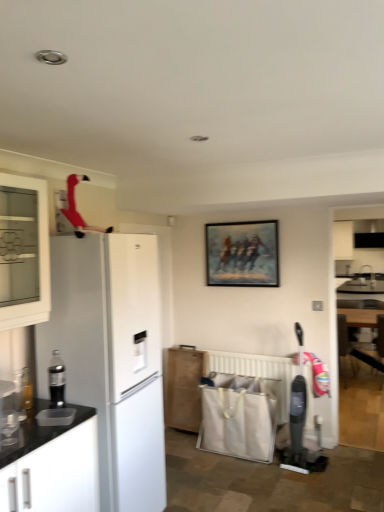
Question: Considering the relative sizes of white plastic radiator at lower center and wooden armchair at lower right in the image provided, is white plastic radiator at lower center thinner than wooden armchair at lower right?

Choices:
 (A) yes
 (B) no

Answer: (A)

Question: From a real-world perspective, is white plastic radiator at lower center positioned under wooden armchair at lower right based on gravity?

Choices:
 (A) yes
 (B) no

Answer: (B)

Question: Does white plastic radiator at lower center come in front of wooden armchair at lower right?

Choices:
 (A) no
 (B) yes

Answer: (B)

Question: Does white plastic radiator at lower center touch wooden armchair at lower right?

Choices:
 (A) no
 (B) yes

Answer: (A)

Question: Can you confirm if white plastic radiator at lower center is positioned to the left of wooden armchair at lower right?

Choices:
 (A) yes
 (B) no

Answer: (A)

Question: Based on their sizes in the image, would you say oil painting at center is bigger or smaller than white plastic radiator at lower center?

Choices:
 (A) small
 (B) big

Answer: (A)

Question: From a real-world perspective, is oil painting at center physically located above or below white plastic radiator at lower center?

Choices:
 (A) above
 (B) below

Answer: (A)

Question: Is oil painting at center taller or shorter than white plastic radiator at lower center?

Choices:
 (A) tall
 (B) short

Answer: (A)

Question: Is oil painting at center wider or thinner than white plastic radiator at lower center?

Choices:
 (A) thin
 (B) wide

Answer: (B)

Question: Based on their positions, is wooden armchair at lower right located to the left or right of black plastic soda dispenser at left?

Choices:
 (A) right
 (B) left

Answer: (A)

Question: From the image's perspective, is wooden armchair at lower right above or below black plastic soda dispenser at left?

Choices:
 (A) above
 (B) below

Answer: (B)

Question: Is wooden armchair at lower right inside or outside of black plastic soda dispenser at left?

Choices:
 (A) inside
 (B) outside

Answer: (B)

Question: From a real-world perspective, is wooden armchair at lower right above or below black plastic soda dispenser at left?

Choices:
 (A) below
 (B) above

Answer: (A)

Question: From a real-world perspective, is wooden cabinet at lower center, positioned as the second cabinetry in top-to-bottom order, physically located above or below black plastic soda dispenser at left?

Choices:
 (A) above
 (B) below

Answer: (B)

Question: From the image's perspective, is wooden cabinet at lower center, positioned as the second cabinetry in top-to-bottom order, above or below black plastic soda dispenser at left?

Choices:
 (A) above
 (B) below

Answer: (B)